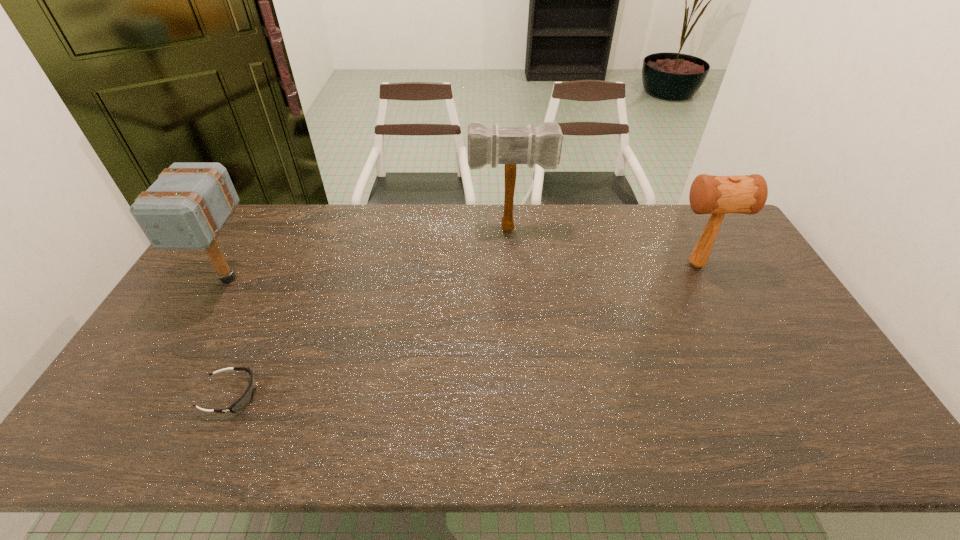
The width and height of the screenshot is (960, 540). What are the coordinates of `vacant area that lies between the second object from right to left and the third object from right to left` in the screenshot? It's located at (371, 312).

Find the location of a particular element. This screenshot has height=540, width=960. vacant space that's between the leftmost object and the second object from right to left is located at coordinates (369, 253).

Where is `free space that is in between the second mallet from right to left and the goggles`? This screenshot has width=960, height=540. free space that is in between the second mallet from right to left and the goggles is located at coordinates (371, 312).

In order to click on vacant area that lies between the farthest object and the shortest object in this screenshot , I will do `click(371, 312)`.

At what (x,y) coordinates should I click in order to perform the action: click on free space that is in between the leftmost object and the second object from right to left. Please return your answer as a coordinate pair (x, y). The height and width of the screenshot is (540, 960). Looking at the image, I should click on (369, 253).

Find the location of a particular element. This screenshot has height=540, width=960. vacant space that is in between the leftmost mallet and the goggles is located at coordinates (229, 337).

The width and height of the screenshot is (960, 540). Find the location of `empty space between the rightmost mallet and the nearest object`. empty space between the rightmost mallet and the nearest object is located at coordinates (464, 330).

This screenshot has height=540, width=960. I want to click on vacant point located between the farthest object and the third object from right to left, so click(x=371, y=312).

You are a GUI agent. You are given a task and a screenshot of the screen. Output one action in this format:
    pyautogui.click(x=<x>, y=<y>)
    Task: Click on the free space between the rightmost object and the leftmost object
    
    Given the screenshot: What is the action you would take?
    pyautogui.click(x=462, y=272)

The image size is (960, 540). Find the location of `free point between the farthest object and the rightmost object`. free point between the farthest object and the rightmost object is located at coordinates (603, 246).